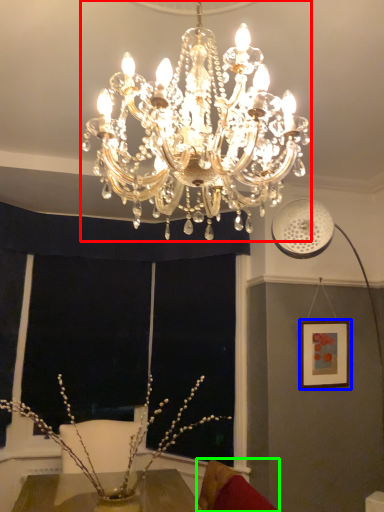
Question: Estimate the real-world distances between objects in this image. Which object is farther from lamp (highlighted by a red box), picture frame (highlighted by a blue box) or swivel chair (highlighted by a green box)?

Choices:
 (A) picture frame
 (B) swivel chair

Answer: (A)